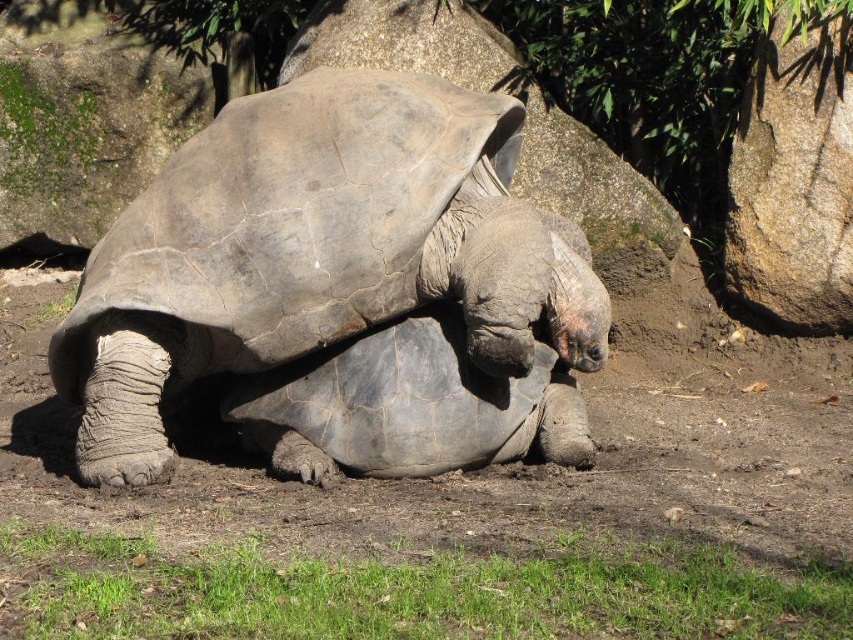
You are a zookeeper who needs to place a new feeding bowl between the gray textured tortoise at center and the gray rough stone at upper center. The bowl requires 3 feet of space to be placed safely. Can you fit the bowl between them?

The gray textured tortoise at center and gray rough stone at upper center are 5.09 feet apart, so yes, the feeding bowl can be placed between them since there is enough space.

You are a zookeeper who needs to place a new feeding station in the enclosure. The feeding station must be placed between the brown rough rock at right and the gray rough stone at upper center. Considering their positions, which object will the feeding station be closer to?

The feeding station will be closer to the brown rough rock at right because it is in front of the gray rough stone at upper center, so the distance between them is shorter.

You are a zookeeper who needs to place a new feeding station in the enclosure. The feeding station must be placed between the gray textured tortoise at center and the brown rough rock at right. Can you fit the feeding station between them if it requires 2 meters of space?

The gray textured tortoise at center is larger in size than the brown rough rock at right. However, the exact distance between them isn not specified in the provided information. Without knowing the actual spacing between the two objects, it is impossible to determine if the feeding station requiring 2 meters of space can be placed between them.